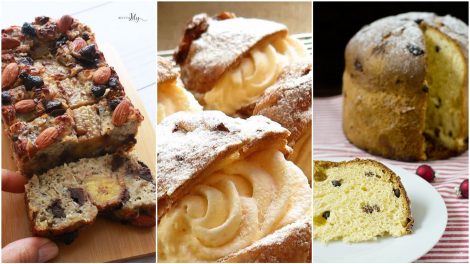
I want to click on cutting board, so click(132, 247).